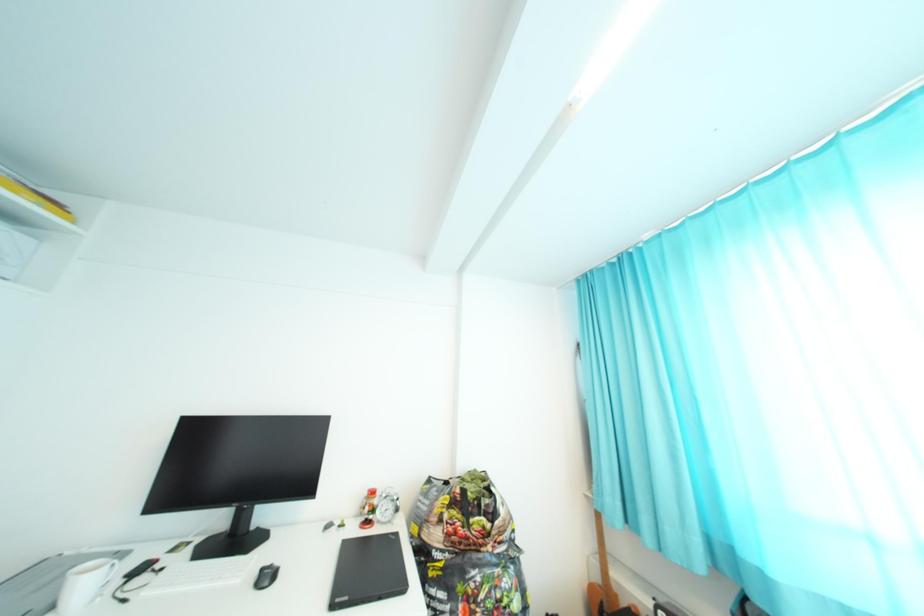
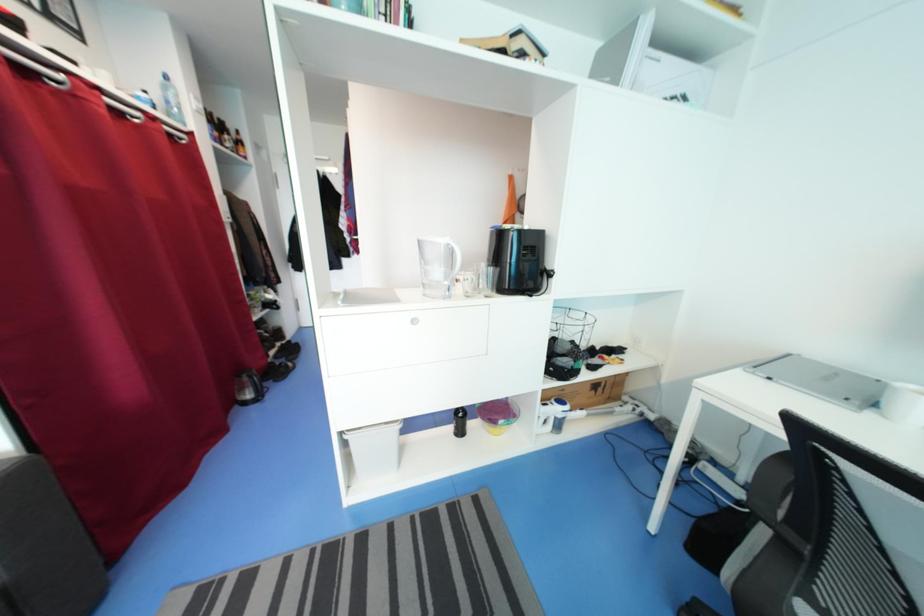
Question: The images are taken continuously from a first-person perspective. In which direction is your viewpoint rotating?

Choices:
 (A) Left
 (B) Right
 (C) Up
 (D) Down

Answer: (A)